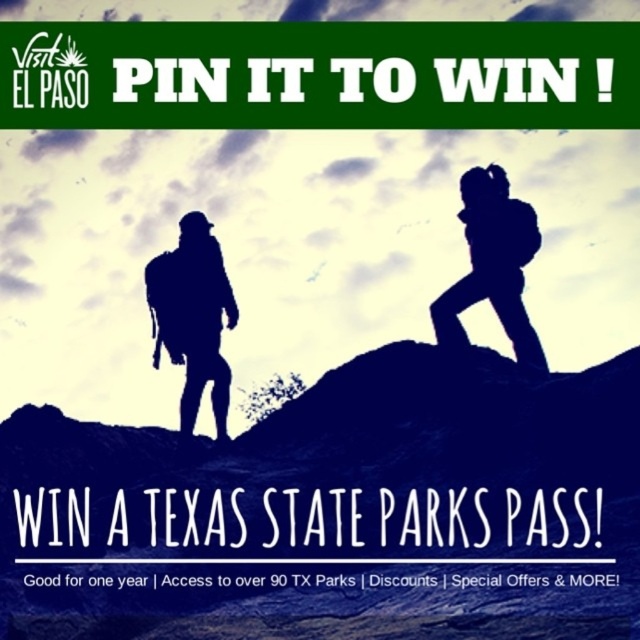
Does black matte backpack at center come in front of silhouette backpack at center?

No.

Image resolution: width=640 pixels, height=640 pixels. In order to click on black matte backpack at center in this screenshot , I will do (x=193, y=316).

Which is behind, point (196, 388) or point (493, 230)?

Point (493, 230)

Image resolution: width=640 pixels, height=640 pixels. I want to click on black matte backpack at center, so click(x=193, y=316).